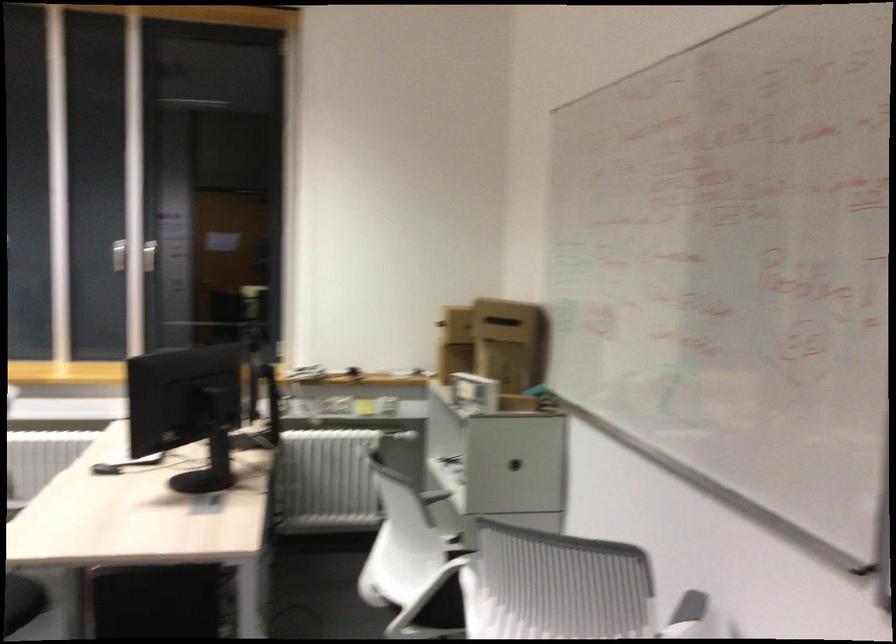
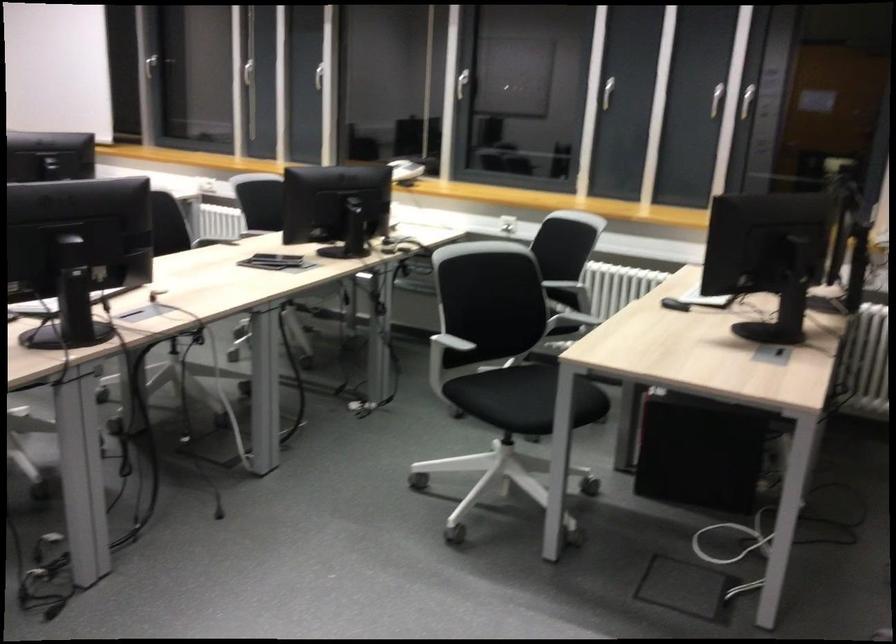
Question: The camera is either moving clockwise (left) or counter-clockwise (right) around the object. The first image is from the beginning of the video and the second image is from the end. Is the camera moving left or right when shooting the video?

Choices:
 (A) Left
 (B) Right

Answer: (B)